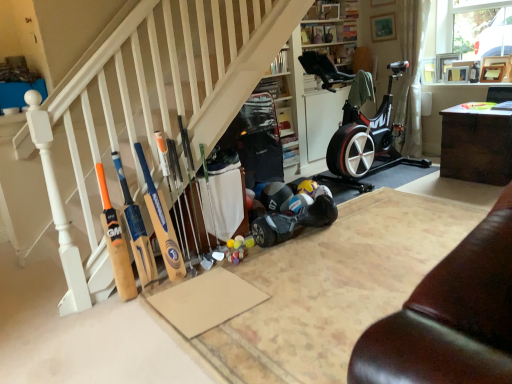
Identify the location of wooden cricket bats at lower left. (151, 106).

In order to face wooden baseball bat at center, marked as the 3th baseball bat in a left-to-right arrangement, should I rotate leftwards or rightwards?

A 9.841 degree turn to the left will do.

What do you see at coordinates (166, 169) in the screenshot? The height and width of the screenshot is (384, 512). I see `wooden baseball bat at center, arranged as the first baseball bat when viewed from the right` at bounding box center [166, 169].

Where is `wooden bat at left, placed as the first baseball bat when sorted from left to right`? The height and width of the screenshot is (384, 512). wooden bat at left, placed as the first baseball bat when sorted from left to right is located at coordinates pos(116,242).

Based on the photo, from the image's perspective, is wooden baseball bat at left, the second baseball bat positioned from the left, beneath wooden baseball bat at center, arranged as the first baseball bat when viewed from the right?

Indeed, from the image's perspective, wooden baseball bat at left, the second baseball bat positioned from the left, is shown beneath wooden baseball bat at center, arranged as the first baseball bat when viewed from the right.

From a real-world perspective, who is located lower, wooden baseball bat at left, positioned as the second baseball bat in right-to-left order, or wooden baseball bat at center, arranged as the first baseball bat when viewed from the right?

wooden baseball bat at center, arranged as the first baseball bat when viewed from the right.

Would you say wooden baseball bat at left, the second baseball bat positioned from the left, is to the left or to the right of wooden baseball bat at center, marked as the 3th baseball bat in a left-to-right arrangement, in the picture?

Based on their positions, wooden baseball bat at left, the second baseball bat positioned from the left, is located to the left of wooden baseball bat at center, marked as the 3th baseball bat in a left-to-right arrangement.

Relative to wooden baseball bat at center, marked as the 3th baseball bat in a left-to-right arrangement, is wooden baseball bat at left, positioned as the second baseball bat in right-to-left order, in front or behind?

wooden baseball bat at left, positioned as the second baseball bat in right-to-left order, is in front of wooden baseball bat at center, marked as the 3th baseball bat in a left-to-right arrangement.

Could you tell me if wooden baseball bat at center, arranged as the first baseball bat when viewed from the right, is facing wooden cricket bats at lower left?

No, wooden baseball bat at center, arranged as the first baseball bat when viewed from the right, does not turn towards wooden cricket bats at lower left.

Does wooden baseball bat at center, marked as the 3th baseball bat in a left-to-right arrangement, appear on the left side of wooden cricket bats at lower left?

Indeed, wooden baseball bat at center, marked as the 3th baseball bat in a left-to-right arrangement, is positioned on the left side of wooden cricket bats at lower left.

From the image's perspective, between wooden baseball bat at center, marked as the 3th baseball bat in a left-to-right arrangement, and wooden cricket bats at lower left, who is located below?

From the image's view, wooden baseball bat at center, marked as the 3th baseball bat in a left-to-right arrangement, is below.

Is wooden baseball bat at center, marked as the 3th baseball bat in a left-to-right arrangement, positioned beyond the bounds of wooden cricket bats at lower left?

Yes, wooden baseball bat at center, marked as the 3th baseball bat in a left-to-right arrangement, is not within wooden cricket bats at lower left.

Locate an element on the screen. This screenshot has width=512, height=384. table on the right of wooden baseball bat at left, positioned as the second baseball bat in right-to-left order is located at coordinates (476, 144).

Can you confirm if wooden baseball bat at left, positioned as the second baseball bat in right-to-left order, is thinner than dark wood table at right?

Yes, wooden baseball bat at left, positioned as the second baseball bat in right-to-left order, is thinner than dark wood table at right.

From the picture: Is wooden baseball bat at left, the second baseball bat positioned from the left, oriented towards dark wood table at right?

No, wooden baseball bat at left, the second baseball bat positioned from the left, is not aimed at dark wood table at right.

From the image's perspective, which object appears higher, wooden baseball bat at left, positioned as the second baseball bat in right-to-left order, or dark wood table at right?

dark wood table at right is shown above in the image.

Can you confirm if dark wood table at right is positioned to the left of wooden bat at left, the 3th baseball bat viewed from the right?

No, dark wood table at right is not to the left of wooden bat at left, the 3th baseball bat viewed from the right.

From a real-world perspective, is dark wood table at right over wooden bat at left, the 3th baseball bat viewed from the right?

No.

Considering the sizes of objects dark wood table at right and wooden bat at left, placed as the first baseball bat when sorted from left to right, in the image provided, who is taller, dark wood table at right or wooden bat at left, placed as the first baseball bat when sorted from left to right,?

With more height is wooden bat at left, placed as the first baseball bat when sorted from left to right.

Is the position of dark wood table at right less distant than that of wooden bat at left, the 3th baseball bat viewed from the right?

That is False.

Measure the distance between dark wood table at right and wooden baseball bat at center, arranged as the first baseball bat when viewed from the right.

dark wood table at right is 2.65 meters from wooden baseball bat at center, arranged as the first baseball bat when viewed from the right.

From the picture: From a real-world perspective, which object stands above the other?

wooden baseball bat at center, arranged as the first baseball bat when viewed from the right, from a real-world perspective.

Between dark wood table at right and wooden baseball bat at center, arranged as the first baseball bat when viewed from the right, which one appears on the right side from the viewer's perspective?

Positioned to the right is dark wood table at right.

This screenshot has width=512, height=384. Identify the location of table lying on the right of wooden baseball bat at center, arranged as the first baseball bat when viewed from the right. (x=476, y=144).

Is wooden cricket bats at lower left a part of wooden bat at left, the 3th baseball bat viewed from the right?

No, wooden cricket bats at lower left is located outside of wooden bat at left, the 3th baseball bat viewed from the right.

From the picture: Does wooden bat at left, the 3th baseball bat viewed from the right, have a lesser height compared to wooden cricket bats at lower left?

Yes.

Can you confirm if wooden bat at left, the 3th baseball bat viewed from the right, is thinner than wooden cricket bats at lower left?

Incorrect, the width of wooden bat at left, the 3th baseball bat viewed from the right, is not less than that of wooden cricket bats at lower left.

Is wooden bat at left, placed as the first baseball bat when sorted from left to right, touching wooden cricket bats at lower left?

No, wooden bat at left, placed as the first baseball bat when sorted from left to right, is not beside wooden cricket bats at lower left.

Consider the image. Which of these two, dark wood table at right or wooden cricket bats at lower left, is smaller?

dark wood table at right is smaller.

Does dark wood table at right lie in front of wooden cricket bats at lower left?

That is False.

Consider the image. How far apart are dark wood table at right and wooden cricket bats at lower left?

dark wood table at right and wooden cricket bats at lower left are 7.92 feet apart from each other.

From the image's perspective, is dark wood table at right located above or below wooden cricket bats at lower left?

dark wood table at right is situated lower than wooden cricket bats at lower left in the image.

Where is `baseball bat behind the wooden baseball bat at left, the second baseball bat positioned from the left`? The image size is (512, 384). baseball bat behind the wooden baseball bat at left, the second baseball bat positioned from the left is located at coordinates (166, 169).

This screenshot has width=512, height=384. Find the location of `baseball bat that is the 2nd object directly below the wooden cricket bats at lower left (from a real-world perspective)`. baseball bat that is the 2nd object directly below the wooden cricket bats at lower left (from a real-world perspective) is located at coordinates (166, 169).

Based on their spatial positions, is wooden baseball bat at center, arranged as the first baseball bat when viewed from the right, or dark wood table at right further from wooden baseball bat at left, the second baseball bat positioned from the left?

dark wood table at right is positioned further to the anchor wooden baseball bat at left, the second baseball bat positioned from the left.

From the image, which object appears to be nearer to dark wood table at right, wooden baseball bat at center, marked as the 3th baseball bat in a left-to-right arrangement, or wooden bat at left, the 3th baseball bat viewed from the right?

wooden baseball bat at center, marked as the 3th baseball bat in a left-to-right arrangement, is closer to dark wood table at right.

Looking at the image, which one is located closer to wooden baseball bat at center, marked as the 3th baseball bat in a left-to-right arrangement, wooden cricket bats at lower left or wooden bat at left, placed as the first baseball bat when sorted from left to right?

Among the two, wooden bat at left, placed as the first baseball bat when sorted from left to right, is located nearer to wooden baseball bat at center, marked as the 3th baseball bat in a left-to-right arrangement.

Looking at the image, which one is located further to dark wood table at right, wooden cricket bats at lower left or wooden baseball bat at left, positioned as the second baseball bat in right-to-left order?

wooden baseball bat at left, positioned as the second baseball bat in right-to-left order, lies further to dark wood table at right than the other object.

When comparing their distances from dark wood table at right, does wooden bat at left, placed as the first baseball bat when sorted from left to right, or wooden baseball bat at center, arranged as the first baseball bat when viewed from the right, seem closer?

Based on the image, wooden baseball bat at center, arranged as the first baseball bat when viewed from the right, appears to be nearer to dark wood table at right.

Estimate the real-world distances between objects in this image. Which object is closer to wooden baseball bat at center, marked as the 3th baseball bat in a left-to-right arrangement, wooden cricket bats at lower left or wooden baseball bat at left, positioned as the second baseball bat in right-to-left order?

→ Among the two, wooden baseball bat at left, positioned as the second baseball bat in right-to-left order, is located nearer to wooden baseball bat at center, marked as the 3th baseball bat in a left-to-right arrangement.

When comparing their distances from wooden baseball bat at left, positioned as the second baseball bat in right-to-left order, does wooden baseball bat at center, arranged as the first baseball bat when viewed from the right, or wooden cricket bats at lower left seem further?

wooden cricket bats at lower left lies further to wooden baseball bat at left, positioned as the second baseball bat in right-to-left order, than the other object.

Which object lies further to the anchor point dark wood table at right, wooden bat at left, the 3th baseball bat viewed from the right, or wooden baseball bat at left, the second baseball bat positioned from the left?

wooden bat at left, the 3th baseball bat viewed from the right, lies further to dark wood table at right than the other object.

Image resolution: width=512 pixels, height=384 pixels. In order to click on baseball bat situated between wooden bat at left, the 3th baseball bat viewed from the right, and wooden baseball bat at center, arranged as the first baseball bat when viewed from the right, from left to right in this screenshot , I will do `click(162, 223)`.

This screenshot has height=384, width=512. Identify the location of baseball bat between wooden cricket bats at lower left and wooden baseball bat at left, the second baseball bat positioned from the left, from top to bottom. point(166,169).

Find the location of a particular element. Image resolution: width=512 pixels, height=384 pixels. stairwell located between wooden bat at left, the 3th baseball bat viewed from the right, and dark wood table at right in the left-right direction is located at coordinates (151, 106).

Where is `baseball bat located between wooden baseball bat at left, positioned as the second baseball bat in right-to-left order, and dark wood table at right in the left-right direction`? This screenshot has height=384, width=512. baseball bat located between wooden baseball bat at left, positioned as the second baseball bat in right-to-left order, and dark wood table at right in the left-right direction is located at coordinates (166, 169).